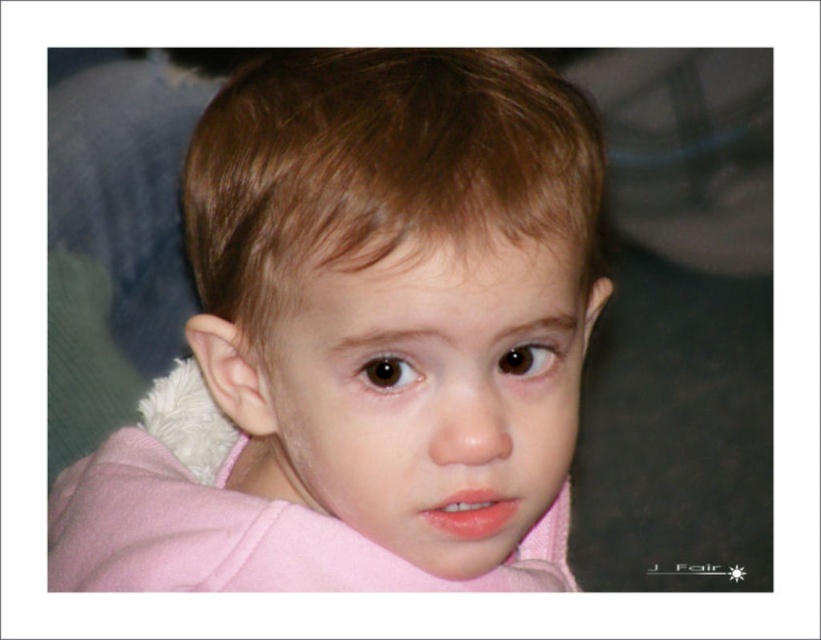
You are a tailor trying to determine which part of the child is more suitable for adding a decorative button. The pink fleece at center and the pink fabric at center are both options. Based on their sizes, which one should you choose?

The pink fleece at center is taller than the pink fabric at center, so the pink fleece at center would be a better choice for adding a decorative button due to its larger size.